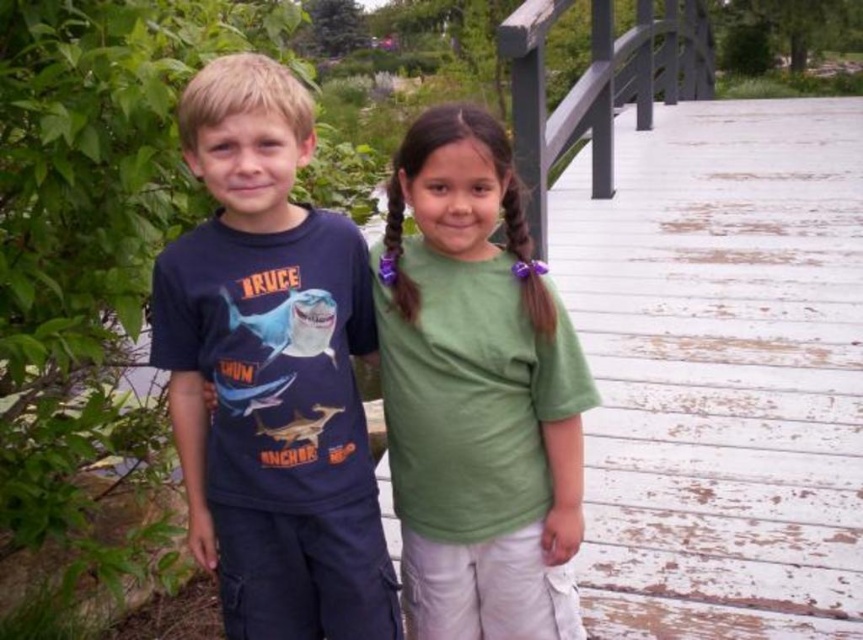
You are a painter who wants to paint the white weathered wood at right and the green cotton shirt at center. Which object should you paint first if you want to start with the one closer to the ground?

The white weathered wood at right is shorter than the green cotton shirt at center, so you should paint the white weathered wood at right first because it is closer to the ground.

You are a painter who wants to paint the scene. You have a limited amount of white paint. Which object should you use less white paint for, the white weathered wood at right or the green cotton shirt at center?

The white weathered wood at right is smaller than the green cotton shirt at center, so you should use less white paint for the white weathered wood at right.